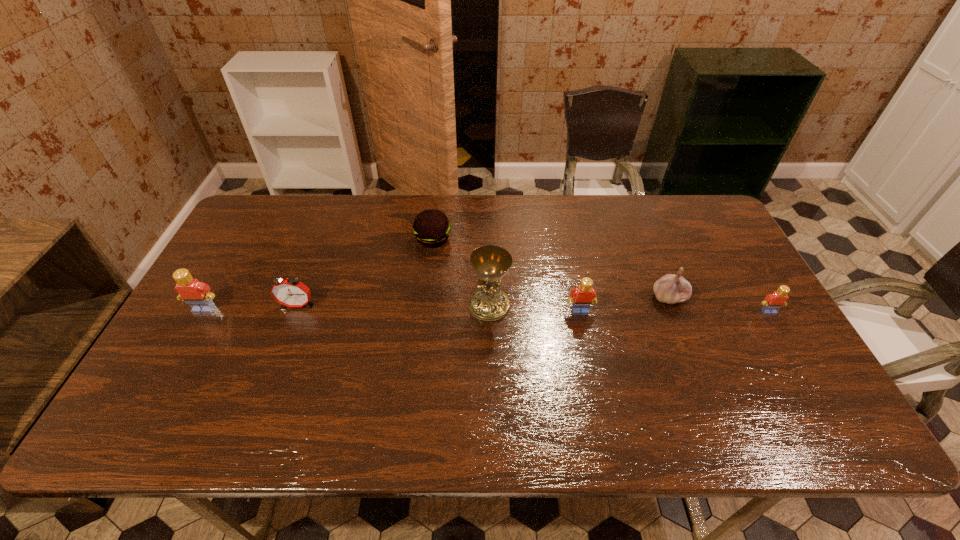
Where is `the sixth object from left to right`? Image resolution: width=960 pixels, height=540 pixels. the sixth object from left to right is located at coordinates (671, 289).

Locate an element on the screen. alarm clock is located at coordinates (291, 292).

In order to click on vacant space located 0.190m on the front-facing side of the leftmost Lego in this screenshot , I will do `click(167, 376)`.

The width and height of the screenshot is (960, 540). I want to click on vacant space located on the front-facing side of the third object from right to left, so click(x=597, y=395).

Find the location of a particular element. This screenshot has width=960, height=540. free spot located 0.210m on the front-facing side of the shortest Lego is located at coordinates (811, 384).

Find the location of a particular element. vacant position located on the left of the fifth object from right to left is located at coordinates (364, 239).

Image resolution: width=960 pixels, height=540 pixels. I want to click on free space located 0.160m on the right of the fourth object from left to right, so click(567, 306).

Locate an element on the screen. free space located on the back of the garlic is located at coordinates (635, 209).

Where is `vacant space located on the clock face of the sixth object from right to left`? This screenshot has width=960, height=540. vacant space located on the clock face of the sixth object from right to left is located at coordinates (264, 393).

Image resolution: width=960 pixels, height=540 pixels. Identify the location of object present at the far edge. (431, 228).